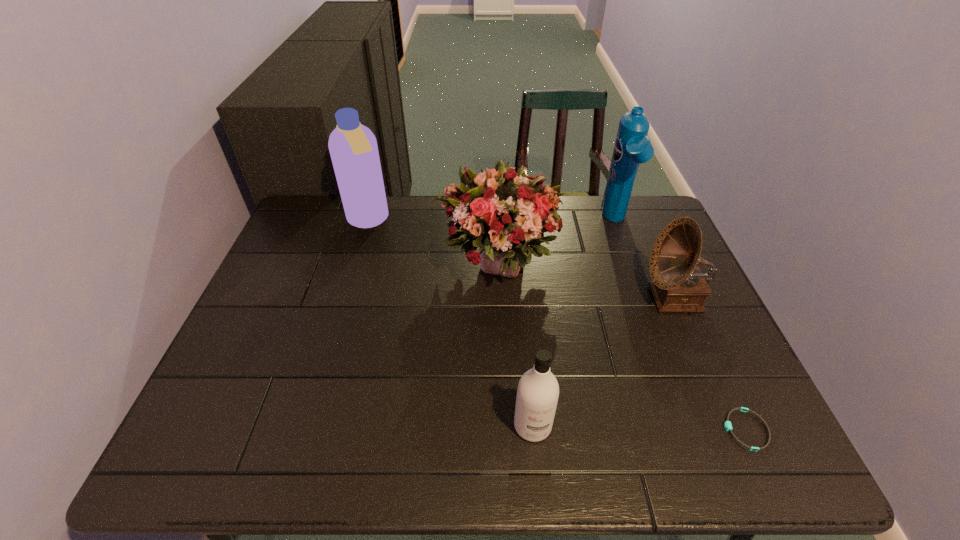
This screenshot has height=540, width=960. Identify the location of vacant region between the fourth shortest object and the leftmost shampoo. (432, 242).

Identify the location of empty space that is in between the shortest object and the leftmost object. (557, 325).

In order to click on unoccupied position between the third tallest object and the shortest shampoo in this screenshot , I will do `click(515, 345)`.

This screenshot has height=540, width=960. What are the coordinates of `vacant area that lies between the shortest shampoo and the phonograph record` in the screenshot? It's located at (604, 362).

This screenshot has width=960, height=540. Identify the location of free space between the phonograph record and the wristband. (709, 364).

This screenshot has width=960, height=540. What are the coordinates of `free space between the shortest object and the second shampoo from left to right` in the screenshot? It's located at (639, 428).

Identify the location of empty location between the nearest shampoo and the leftmost shampoo. Image resolution: width=960 pixels, height=540 pixels. (450, 323).

Where is `free space between the leftmost object and the shortest object`? The height and width of the screenshot is (540, 960). free space between the leftmost object and the shortest object is located at coordinates (557, 325).

You are a GUI agent. You are given a task and a screenshot of the screen. Output one action in this format:
    pyautogui.click(x=<x>, y=<y>)
    Task: Click on the object that is the fifth nearest to the rightmost shampoo
    
    Given the screenshot: What is the action you would take?
    pyautogui.click(x=353, y=148)

Locate which object ranks fourth in proximity to the wristband. Please provide its 2D coordinates. Your answer should be formatted as a tuple, i.e. [(x, y)], where the tuple contains the x and y coordinates of a point satisfying the conditions above.

[(632, 147)]